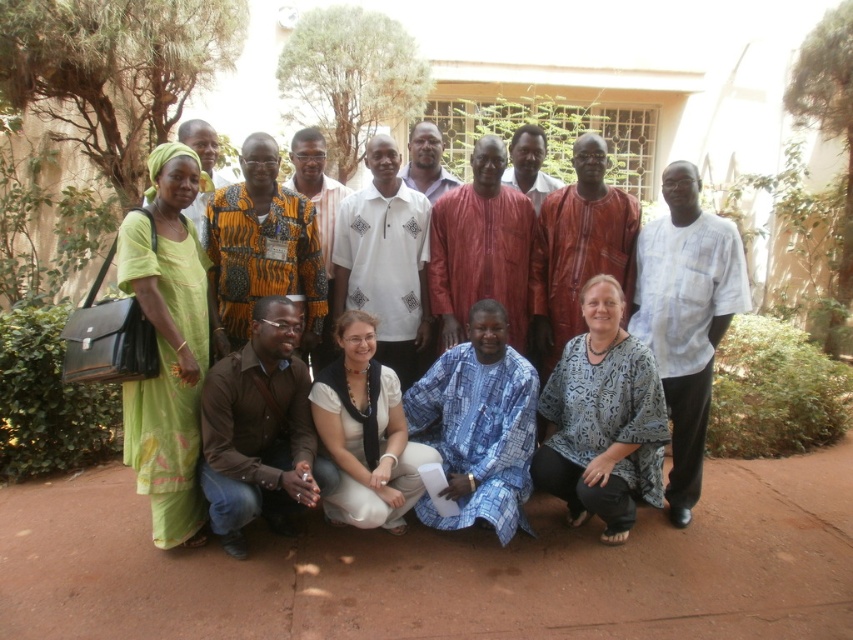
Question: Considering the relative positions of green woven fabric dress at left and matte red shirt at center in the image provided, where is green woven fabric dress at left located with respect to matte red shirt at center?

Choices:
 (A) above
 (B) below

Answer: (B)

Question: Which object is the farthest from the blue printed fabric at center?

Choices:
 (A) white cotton shirt at center
 (B) matte red shirt at center
 (C) matte purple shirt at center
 (D) white cotton blouse at center

Answer: (C)

Question: Considering the relative positions of green woven fabric dress at left and patterned fabric blouse at lower center in the image provided, where is green woven fabric dress at left located with respect to patterned fabric blouse at lower center?

Choices:
 (A) left
 (B) right

Answer: (A)

Question: Which object is the closest to the brown leather shirt at lower left?

Choices:
 (A) matte red shirt at center
 (B) white patterned shirt at center

Answer: (B)

Question: Based on their relative distances, which object is nearer to the white patterned shirt at center?

Choices:
 (A) matte red shirt at center
 (B) matte red fabric at center

Answer: (B)

Question: Can you confirm if white cotton shirt at center is positioned below matte red shirt at center?

Choices:
 (A) yes
 (B) no

Answer: (A)